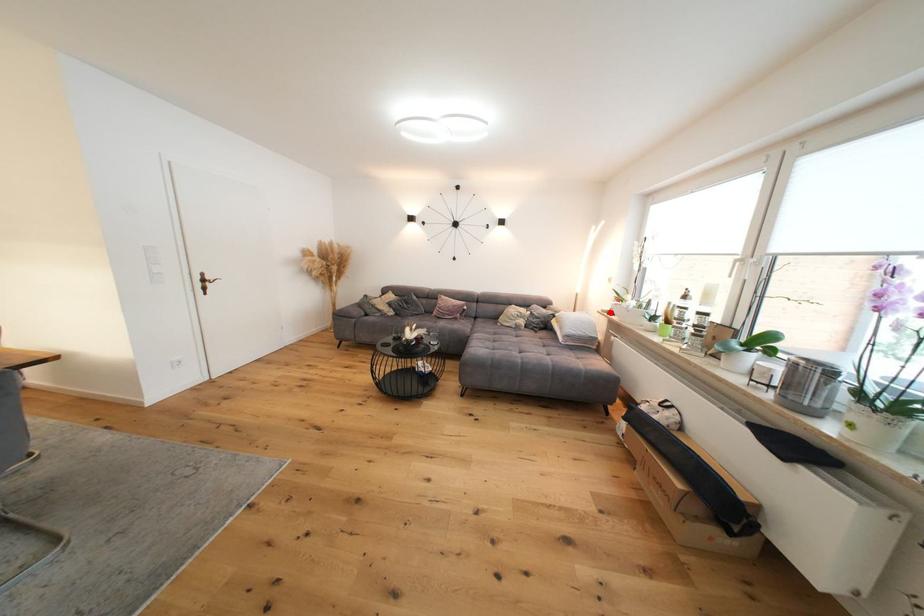
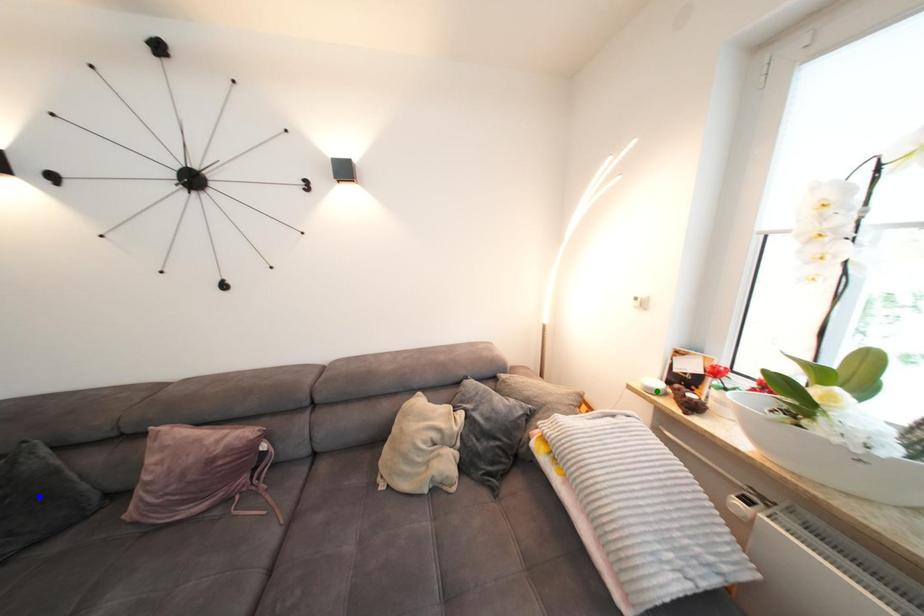
Question: I am providing you with two images of the same scene from different viewpoints. A red point is marked on the first image. You are given multiple points on the second image. Which spot in image 2 lines up with the point in image 1?

Choices:
 (A) green point
 (B) yellow point
 (C) blue point

Answer: (A)